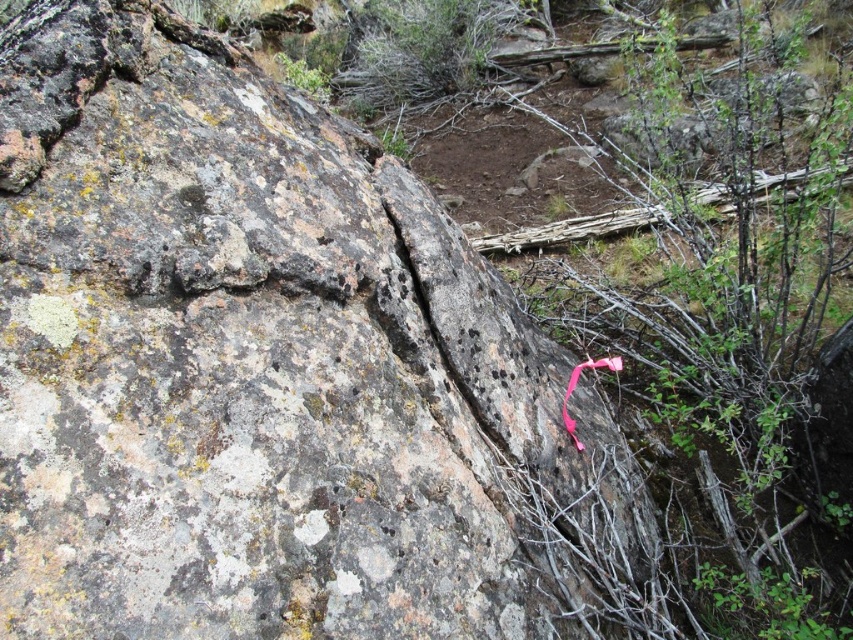
Question: Is pink fabric at center above pink fabric ribbon at lower right?

Choices:
 (A) yes
 (B) no

Answer: (A)

Question: Which point appears farthest from the camera in this image?

Choices:
 (A) (572, 436)
 (B) (666, 323)

Answer: (B)

Question: Where is pink fabric at center located in relation to pink fabric ribbon at lower right in the image?

Choices:
 (A) below
 (B) above

Answer: (B)

Question: Does pink fabric at center appear over pink fabric ribbon at lower right?

Choices:
 (A) no
 (B) yes

Answer: (B)